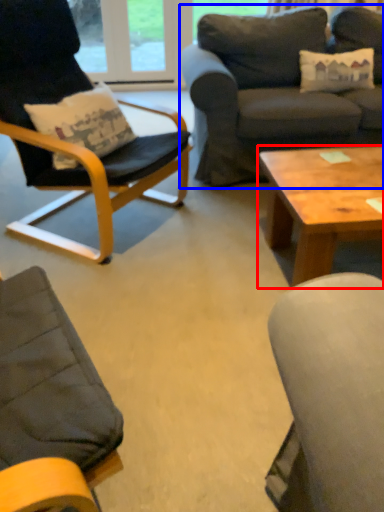
Question: Which object appears closest to the camera in this image, coffee table (highlighted by a red box) or studio couch (highlighted by a blue box)?

Choices:
 (A) coffee table
 (B) studio couch

Answer: (A)